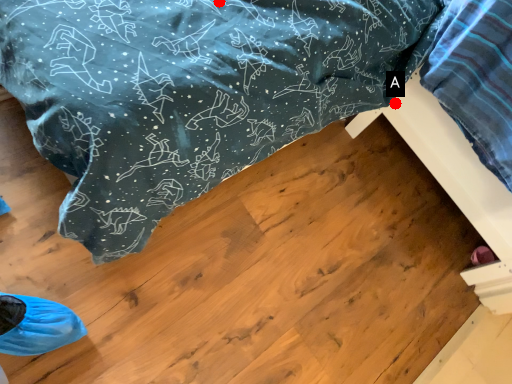
Question: Two points are circled on the image, labeled by A and B beside each circle. Which point appears farthest from the camera in this image?

Choices:
 (A) A is further
 (B) B is further

Answer: (A)